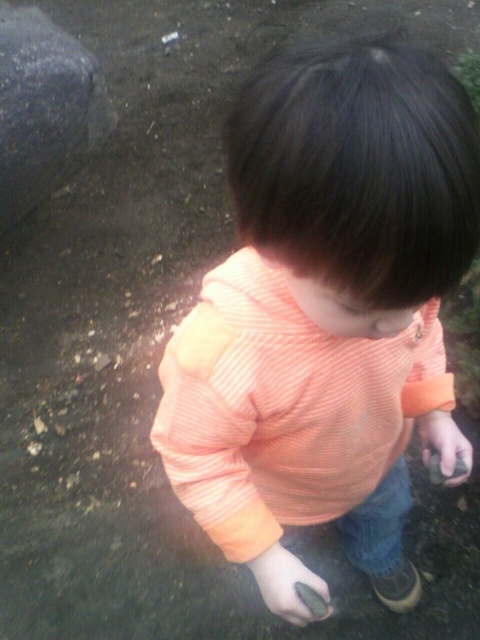
Does point (15, 188) come closer to viewer compared to point (440, 472)?

No, it is not.

Can you confirm if smooth gray rock at upper left is thinner than smooth gray rock at lower right?

In fact, smooth gray rock at upper left might be wider than smooth gray rock at lower right.

Identify the location of smooth gray rock at upper left. (44, 108).

The image size is (480, 640). Identify the location of smooth gray rock at upper left. click(x=44, y=108).

Which of these two, orange striped shirt at center or smooth gray rock at lower center, stands taller?

Standing taller between the two is orange striped shirt at center.

Who is lower down, orange striped shirt at center or smooth gray rock at lower center?

smooth gray rock at lower center is below.

At what (x,y) coordinates should I click in order to perform the action: click on orange striped shirt at center. Please return your answer as a coordinate pair (x, y). Looking at the image, I should click on (325, 304).

Does smooth gray rock at lower center have a lesser width compared to smooth gray rock at lower right?

No.

Looking at this image, between smooth gray rock at lower center and smooth gray rock at lower right, which one has less height?

smooth gray rock at lower center

Is point (303, 602) behind point (442, 433)?

No.

Locate an element on the screen. The image size is (480, 640). smooth gray rock at lower center is located at coordinates (288, 584).